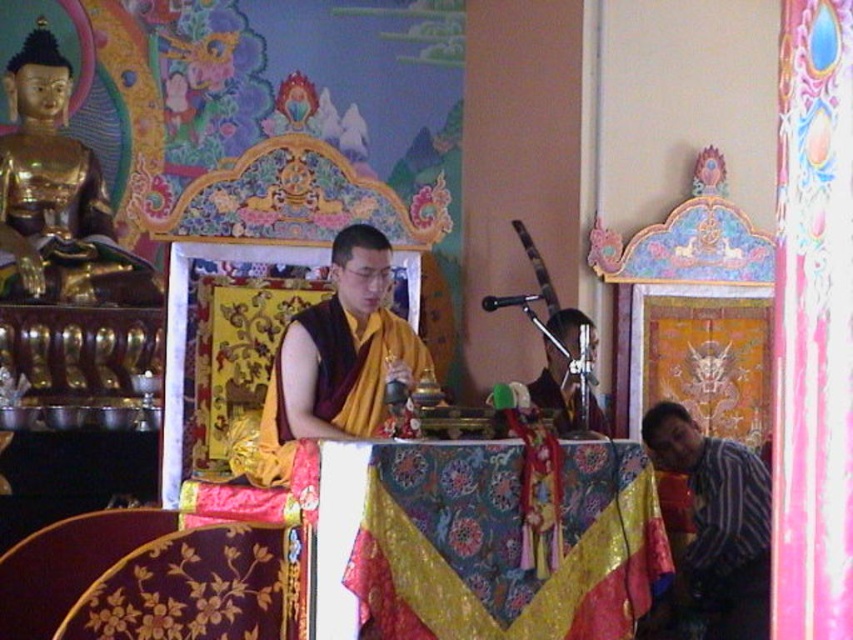
You are a photographer standing at the entrance of the temple. You want to take a closeup photo of the gold polished statue at upper left. Given that your camera has a maximum zoom range of 100 feet, will you be able to capture it clearly without moving closer?

The gold polished statue at upper left is 135.32 feet away from camera. Since the camera can only zoom up to 100 feet, it cannot capture the statue clearly at this distance. You need to move closer to within 100 feet or use a different camera with a longer zoom range.

You are an interior designer planning to place a new decorative item in the temple scene. The item must fit between the yellow silk monk at center and the silky yellow robe at center. Based on their widths, can you determine if there will be enough space for an item that is 1 meter wide?

The yellow silk monk at center might be wider than the silky yellow robe at center, so the space between them may not be sufficient for a 1 meter wide item. The exact width difference is uncertain, so it is recommended to measure the actual space before placing the item.

Based on the scene described, which object is positioned higher in the image? The gold polished statue at upper left or the yellow silk monk at center?

The gold polished statue at upper left is positioned higher than the yellow silk monk at center.